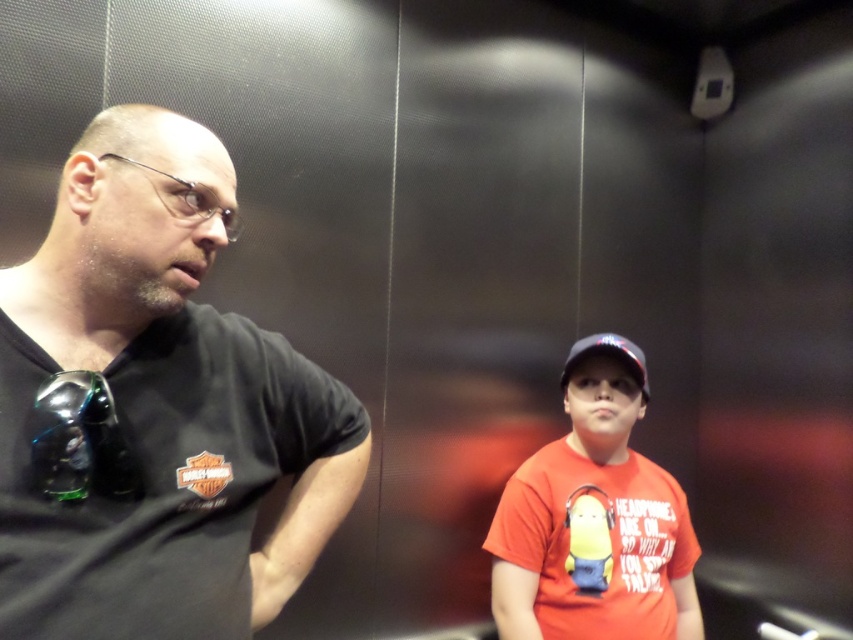
You are standing in an elevator and want to know where the black matte shirt at left is located. Can you describe its position using coordinates?

The black matte shirt at left is located at coordinates point (158, 406).